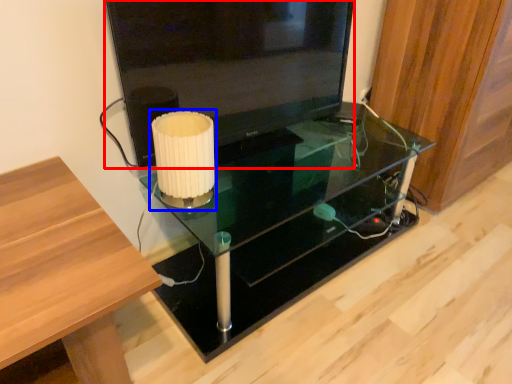
Question: Among these objects, which one is nearest to the camera, television (highlighted by a red box) or table lamp (highlighted by a blue box)?

Choices:
 (A) television
 (B) table lamp

Answer: (A)